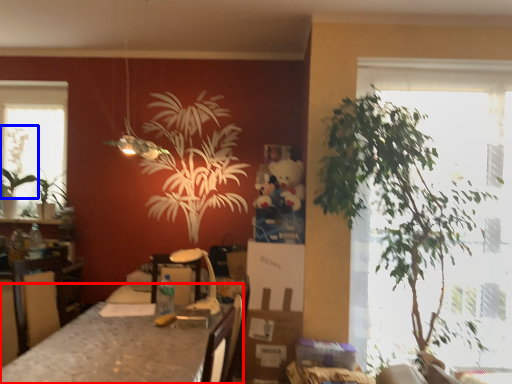
Question: Which object is further to the camera taking this photo, table (highlighted by a red box) or plant (highlighted by a blue box)?

Choices:
 (A) table
 (B) plant

Answer: (B)